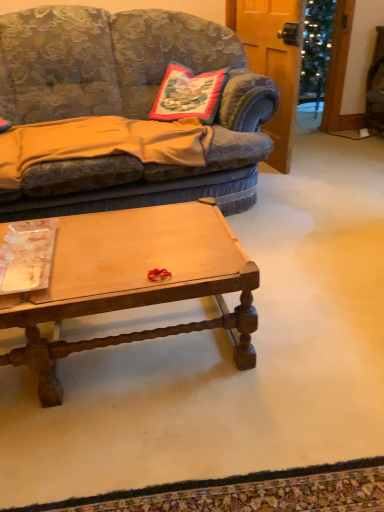
Question: Can you confirm if embroidered fabric pillow at center is thinner than orange cotton blanket at left?

Choices:
 (A) yes
 (B) no

Answer: (A)

Question: From a real-world perspective, is embroidered fabric pillow at center under orange cotton blanket at left?

Choices:
 (A) yes
 (B) no

Answer: (B)

Question: Is embroidered fabric pillow at center wider than orange cotton blanket at left?

Choices:
 (A) yes
 (B) no

Answer: (B)

Question: Is there a large distance between embroidered fabric pillow at center and orange cotton blanket at left?

Choices:
 (A) yes
 (B) no

Answer: (B)

Question: Is embroidered fabric pillow at center positioned behind orange cotton blanket at left?

Choices:
 (A) yes
 (B) no

Answer: (A)

Question: From the image's perspective, is velvet fabric couch at center located above or below orange cotton blanket at left?

Choices:
 (A) above
 (B) below

Answer: (A)

Question: In terms of width, does velvet fabric couch at center look wider or thinner when compared to orange cotton blanket at left?

Choices:
 (A) thin
 (B) wide

Answer: (B)

Question: From a real-world perspective, is velvet fabric couch at center positioned above or below orange cotton blanket at left?

Choices:
 (A) above
 (B) below

Answer: (A)

Question: Based on their sizes in the image, would you say velvet fabric couch at center is bigger or smaller than orange cotton blanket at left?

Choices:
 (A) small
 (B) big

Answer: (B)

Question: Looking at their shapes, would you say orange cotton blanket at left is wider or thinner than embroidered fabric pillow at center?

Choices:
 (A) wide
 (B) thin

Answer: (A)

Question: From a real-world perspective, is orange cotton blanket at left above or below embroidered fabric pillow at center?

Choices:
 (A) above
 (B) below

Answer: (B)

Question: Is orange cotton blanket at left spatially inside embroidered fabric pillow at center, or outside of it?

Choices:
 (A) inside
 (B) outside

Answer: (B)

Question: Considering the positions of point (x=117, y=117) and point (x=193, y=72), is point (x=117, y=117) closer or farther from the camera than point (x=193, y=72)?

Choices:
 (A) closer
 (B) farther

Answer: (A)

Question: Choose the correct answer: Is embroidered fabric pillow at center inside velvet fabric couch at center or outside it?

Choices:
 (A) inside
 (B) outside

Answer: (A)

Question: Considering the positions of embroidered fabric pillow at center and velvet fabric couch at center in the image, is embroidered fabric pillow at center wider or thinner than velvet fabric couch at center?

Choices:
 (A) thin
 (B) wide

Answer: (A)